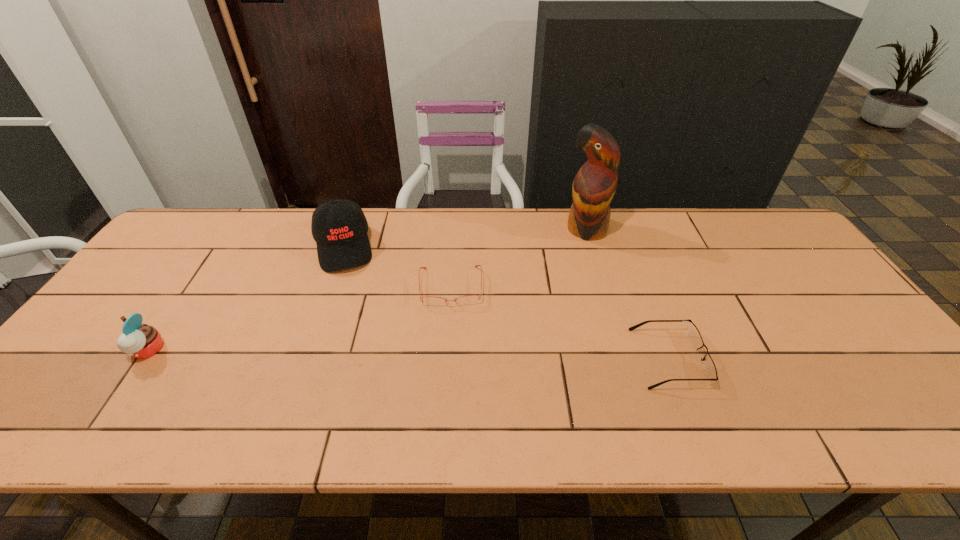
At what (x,y) coordinates should I click in order to perform the action: click on vacant area situated 0.390m on the front-facing side of the fourth object from right to left. Please return your answer as a coordinate pair (x, y). The image size is (960, 540). Looking at the image, I should click on (364, 382).

Where is `free space located 0.140m on the front-facing side of the fourth object from right to left`? The image size is (960, 540). free space located 0.140m on the front-facing side of the fourth object from right to left is located at coordinates (350, 307).

Where is `vacant area situated on the front-facing side of the fourth object from right to left`? vacant area situated on the front-facing side of the fourth object from right to left is located at coordinates (348, 292).

Identify the location of vacant space located on the face of the parrot. The width and height of the screenshot is (960, 540). (558, 262).

Locate an element on the screen. The width and height of the screenshot is (960, 540). free space located on the face of the parrot is located at coordinates (548, 273).

At what (x,y) coordinates should I click in order to perform the action: click on vacant point located on the face of the parrot. Please return your answer as a coordinate pair (x, y). The image size is (960, 540). Looking at the image, I should click on (546, 275).

Locate an element on the screen. The image size is (960, 540). free space located on the lenses of the third object from right to left is located at coordinates (451, 357).

I want to click on vacant space situated on the lenses of the third object from right to left, so click(x=451, y=382).

Where is `free space located on the lenses of the third object from right to left`? free space located on the lenses of the third object from right to left is located at coordinates (451, 354).

Locate an element on the screen. The height and width of the screenshot is (540, 960). baseball cap situated at the far edge is located at coordinates (339, 227).